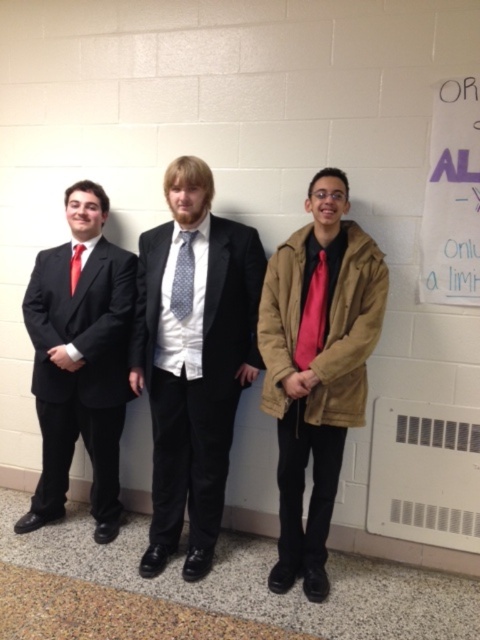
Question: Which object is the closest to the matte black suit at left?

Choices:
 (A) white paper at upper right
 (B) gray dotted tie at center
 (C) matte red tie at left

Answer: (C)

Question: Does white paper at upper right have a larger size compared to matte red tie at left?

Choices:
 (A) no
 (B) yes

Answer: (B)

Question: Which of the following is the closest to the observer?

Choices:
 (A) (474, 273)
 (B) (80, 269)

Answer: (A)

Question: Can you confirm if tan suede jacket at center is positioned above white paper at upper right?

Choices:
 (A) no
 (B) yes

Answer: (A)

Question: Is tan suede jacket at center closer to camera compared to matte black suit at left?

Choices:
 (A) yes
 (B) no

Answer: (A)

Question: Which of these objects is positioned farthest from the matte red tie at left?

Choices:
 (A) matte black suit at left
 (B) polished black suit at center

Answer: (B)